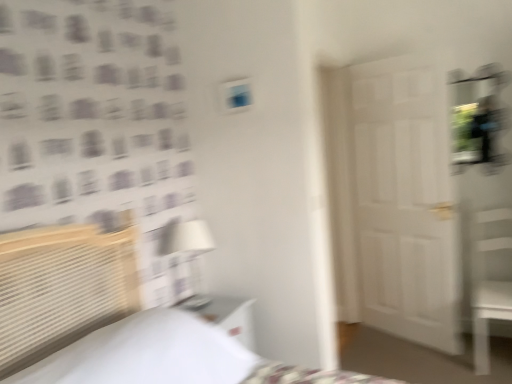
Question: Does point (x=180, y=291) appear closer or farther from the camera than point (x=429, y=102)?

Choices:
 (A) farther
 (B) closer

Answer: (B)

Question: Is white fabric lampshade at center situated inside white matte door at center or outside?

Choices:
 (A) inside
 (B) outside

Answer: (B)

Question: Which is nearer to the white glossy nightstand at lower center?

Choices:
 (A) white woven bed at left
 (B) white wood chair at right
 (C) white fabric lampshade at center
 (D) white matte door at center

Answer: (C)

Question: Which object is positioned closest to the white woven bed at left?

Choices:
 (A) white glossy nightstand at lower center
 (B) white matte door at center
 (C) white wood chair at right
 (D) white fabric lampshade at center

Answer: (A)